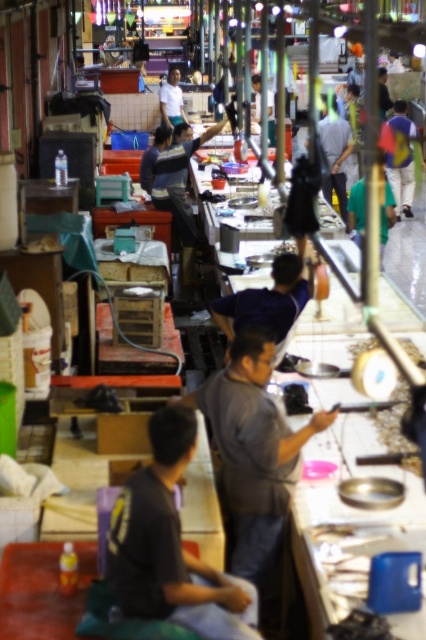
You are a customer in the market and need to decide which vendor to approach. You notice two vendors wearing the gray matte shirt at center and the blue fabric shirt at upper right. Which vendor is wearing a smaller sized shirt?

The gray matte shirt at center has a smaller size compared to the blue fabric shirt at upper right, so the vendor wearing the gray matte shirt at center has the smaller sized shirt.

You are a customer in the market and want to locate the vendor who is wearing a gray matte shirt at center. According to the coordinates provided, where should you look to find this vendor?

The gray matte shirt at center is located at coordinates point (253, 451).